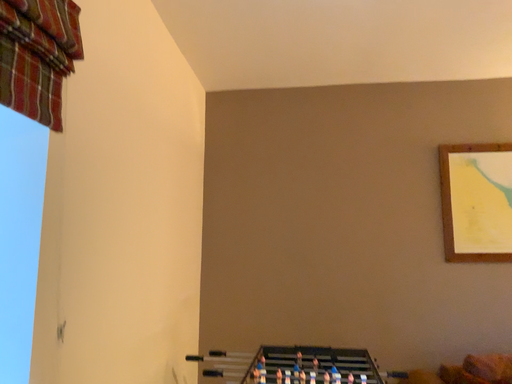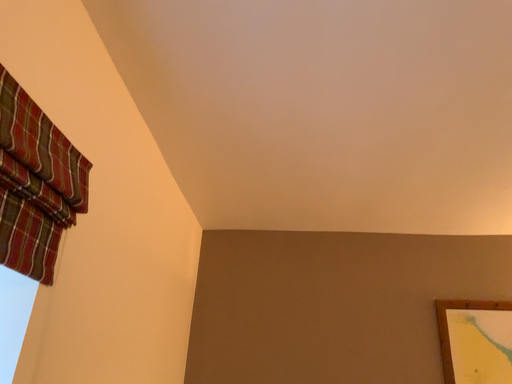
Question: Which way did the camera rotate in the video?

Choices:
 (A) rotated upward
 (B) rotated downward

Answer: (A)